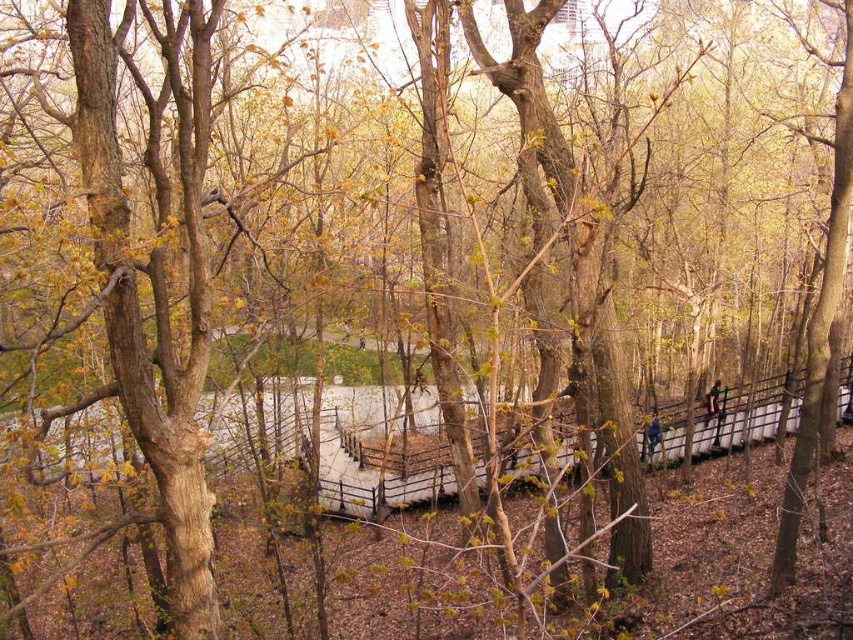
Question: Is blue denim jeans at right positioned in front of dark brown leather jacket at center-right?

Choices:
 (A) yes
 (B) no

Answer: (A)

Question: Which object is farther from the camera taking this photo?

Choices:
 (A) blue denim jeans at right
 (B) dark brown leather jacket at center-right

Answer: (B)

Question: Is blue denim jeans at right smaller than dark brown leather jacket at center-right?

Choices:
 (A) no
 (B) yes

Answer: (A)

Question: From the image, what is the correct spatial relationship of blue denim jeans at right in relation to dark brown leather jacket at center-right?

Choices:
 (A) below
 (B) above

Answer: (A)